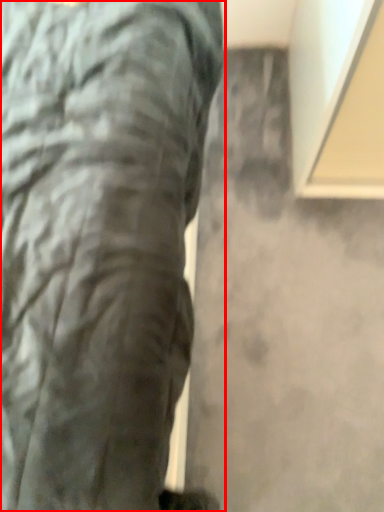
Question: From the image's perspective, where is trousers (annotated by the red box) located relative to concrete?

Choices:
 (A) above
 (B) below

Answer: (A)